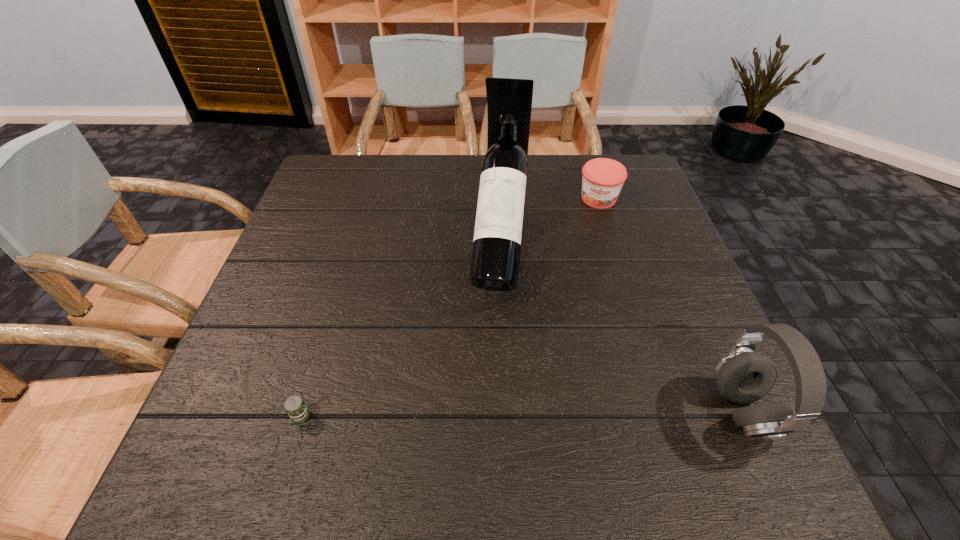
You are a GUI agent. You are given a task and a screenshot of the screen. Output one action in this format:
    pyautogui.click(x=<x>, y=<y>)
    Task: Click on the leftmost object
    Image resolution: width=960 pixels, height=540 pixels.
    Given the screenshot: What is the action you would take?
    pyautogui.click(x=295, y=407)

The image size is (960, 540). I want to click on beer can, so click(x=295, y=407).

The width and height of the screenshot is (960, 540). Identify the location of the third shortest object. (743, 376).

Image resolution: width=960 pixels, height=540 pixels. Identify the location of the rightmost object. (743, 376).

Find the location of a particular element. the third object from left to right is located at coordinates (602, 180).

Identify the location of the second shortest object. The height and width of the screenshot is (540, 960). (602, 180).

At what (x,y) coordinates should I click in order to perform the action: click on the tallest object. Please return your answer as a coordinate pair (x, y). The width and height of the screenshot is (960, 540). Looking at the image, I should click on (495, 262).

This screenshot has width=960, height=540. I want to click on wine bottle, so click(495, 262).

This screenshot has width=960, height=540. Identify the location of free space located on the back of the beer can. (348, 261).

The height and width of the screenshot is (540, 960). In order to click on free spot located 0.090m on the front label of the second object from right to left in this screenshot , I will do `click(594, 232)`.